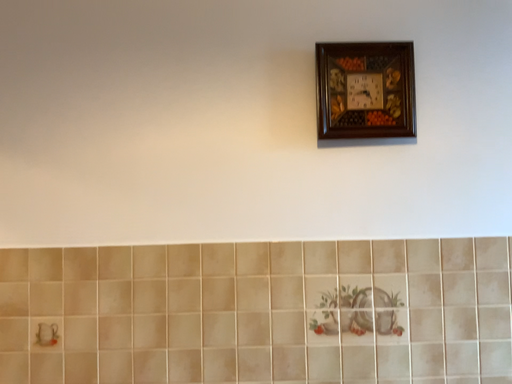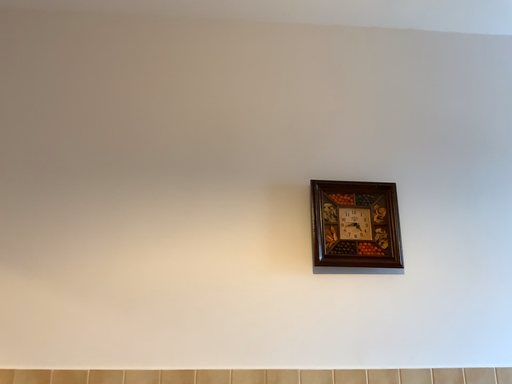
Question: How did the camera likely rotate when shooting the video?

Choices:
 (A) rotated upward
 (B) rotated downward

Answer: (A)